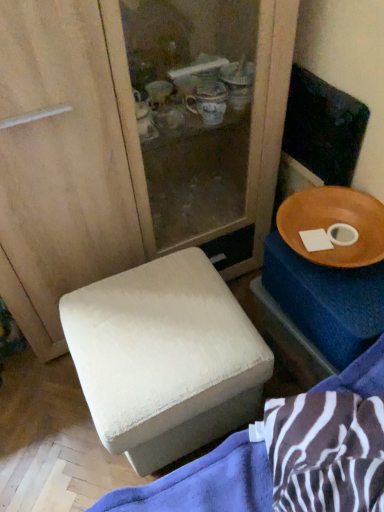
You are a GUI agent. You are given a task and a screenshot of the screen. Output one action in this format:
    pyautogui.click(x=<x>, y=<y>)
    Task: Click on the vacant space situated above wooden tray at right (from a real-world perspective)
    Image resolution: width=384 pixels, height=512 pixels.
    Given the screenshot: What is the action you would take?
    pyautogui.click(x=338, y=245)